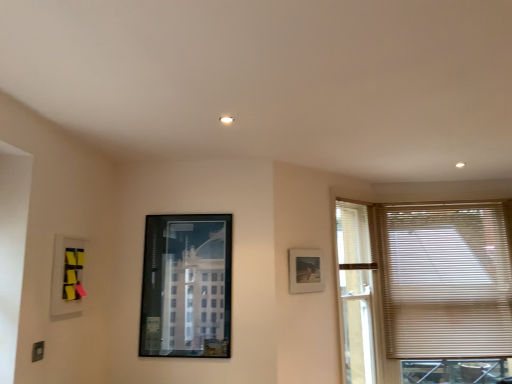
Question: Is matte plastic picture frame at upper left, positioned as the 1th picture frame in front-to-back order, behind beige blinds at right?

Choices:
 (A) yes
 (B) no

Answer: (B)

Question: Are matte plastic picture frame at upper left, which ranks as the third picture frame in right-to-left order, and beige blinds at right beside each other?

Choices:
 (A) yes
 (B) no

Answer: (B)

Question: From the image's perspective, is matte plastic picture frame at upper left, positioned as the 1th picture frame in front-to-back order, below beige blinds at right?

Choices:
 (A) no
 (B) yes

Answer: (A)

Question: Considering the relative sizes of matte plastic picture frame at upper left, positioned as the 1th picture frame in front-to-back order, and beige blinds at right in the image provided, is matte plastic picture frame at upper left, positioned as the 1th picture frame in front-to-back order, wider than beige blinds at right?

Choices:
 (A) yes
 (B) no

Answer: (B)

Question: Considering the relative sizes of matte plastic picture frame at upper left, positioned as the 1th picture frame in front-to-back order, and beige blinds at right in the image provided, is matte plastic picture frame at upper left, positioned as the 1th picture frame in front-to-back order, shorter than beige blinds at right?

Choices:
 (A) no
 (B) yes

Answer: (B)

Question: Considering the relative positions of matte plastic picture frame at upper left, positioned as the 1th picture frame in front-to-back order, and beige blinds at right in the image provided, is matte plastic picture frame at upper left, positioned as the 1th picture frame in front-to-back order, to the left of beige blinds at right from the viewer's perspective?

Choices:
 (A) no
 (B) yes

Answer: (B)

Question: Is metallic glass picture frame at center, positioned as the 2th picture frame in left-to-right order, at the back of beige blinds at right?

Choices:
 (A) yes
 (B) no

Answer: (B)

Question: Considering the relative sizes of beige blinds at right and metallic glass picture frame at center, the second picture frame viewed from the front, in the image provided, is beige blinds at right smaller than metallic glass picture frame at center, the second picture frame viewed from the front,?

Choices:
 (A) no
 (B) yes

Answer: (A)

Question: Can we say beige blinds at right lies outside metallic glass picture frame at center, the second picture frame viewed from the front?

Choices:
 (A) yes
 (B) no

Answer: (A)

Question: Does beige blinds at right have a lesser height compared to metallic glass picture frame at center, acting as the 2th picture frame starting from the back?

Choices:
 (A) no
 (B) yes

Answer: (A)

Question: Does beige blinds at right have a greater height compared to metallic glass picture frame at center, the second picture frame viewed from the front?

Choices:
 (A) no
 (B) yes

Answer: (B)

Question: Is beige blinds at right facing towards metallic glass picture frame at center, acting as the 2th picture frame starting from the back?

Choices:
 (A) yes
 (B) no

Answer: (B)

Question: Considering the relative sizes of matte plastic picture frame at upper left, positioned as the 1th picture frame in front-to-back order, and matte black picture frame at upper right, the first picture frame from the back, in the image provided, is matte plastic picture frame at upper left, positioned as the 1th picture frame in front-to-back order, thinner than matte black picture frame at upper right, the first picture frame from the back,?

Choices:
 (A) yes
 (B) no

Answer: (B)